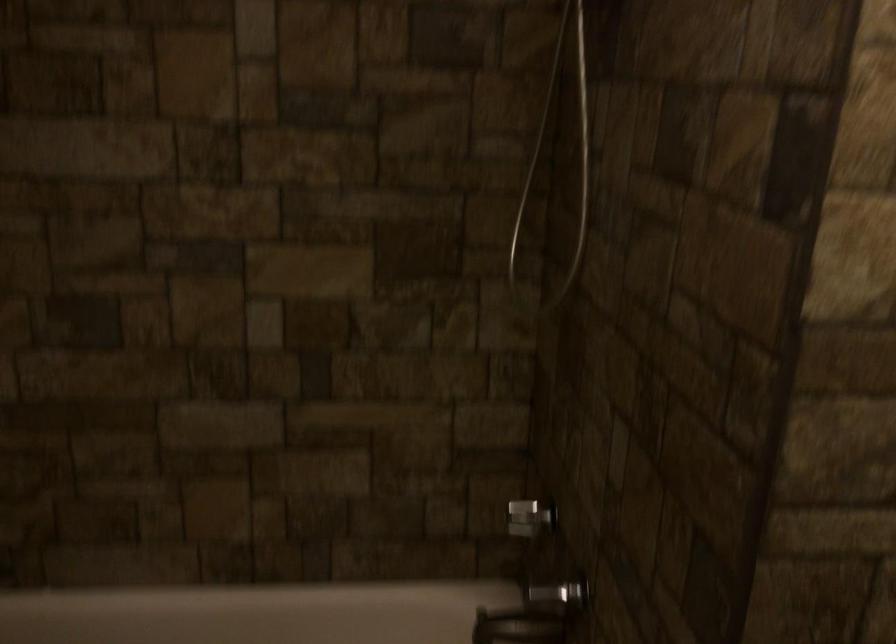
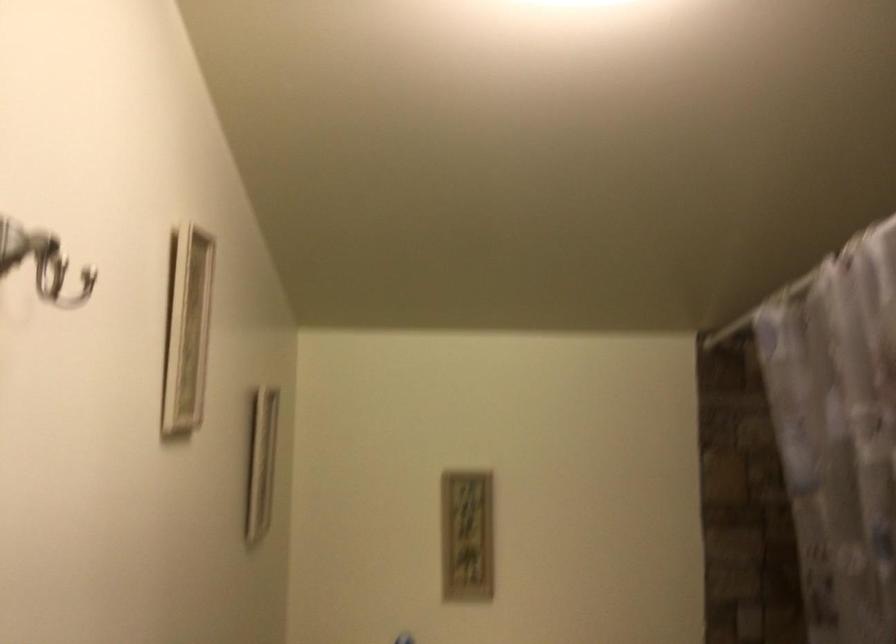
Question: The images are taken continuously from a first-person perspective. In which direction is your viewpoint rotating?

Choices:
 (A) Left
 (B) Right
 (C) Up
 (D) Down

Answer: (A)